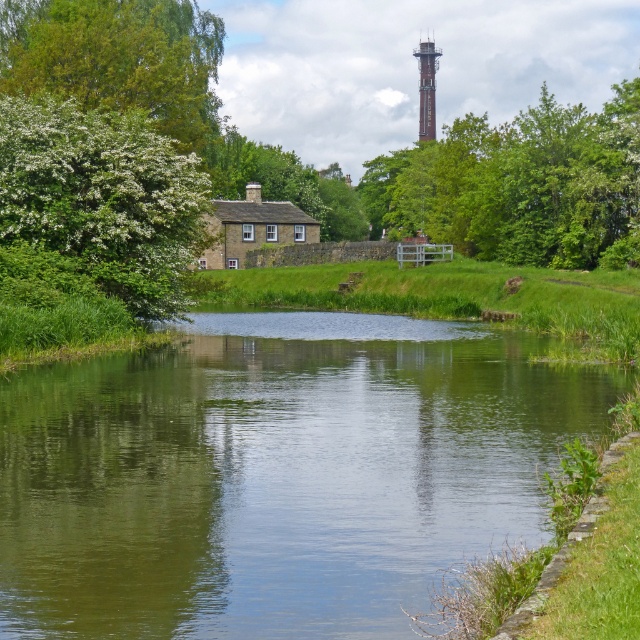
You are standing at the point marked as point (464, 536) in the image, which is 14.48 meters away from you. You want to cross the waterway to reach the trees on the left. Is there enough space between you and the trees to walk through?

The point (464, 536) is 14.48 meters away from the viewer. Since the trees are on the left side of the image and the waterway is in the foreground, the distance between you and the trees would require crossing the waterway first. However, the provided information does not specify the width of the waterway, so it is unclear if there is enough space to walk through.

You are a photographer positioned at the waterway in the foreground. You want to capture a photo that includes both the white blossoming bush at left and the brick tower at upper center. Which object will appear closer to the camera in the final photo?

The white blossoming bush at left will appear closer to the camera in the photo because it is positioned in front of the brick tower at upper center.